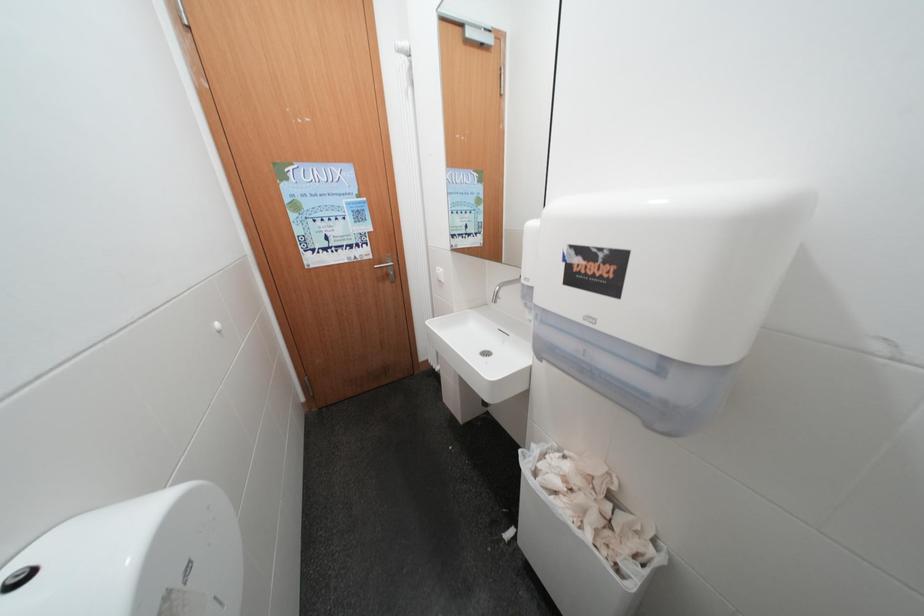
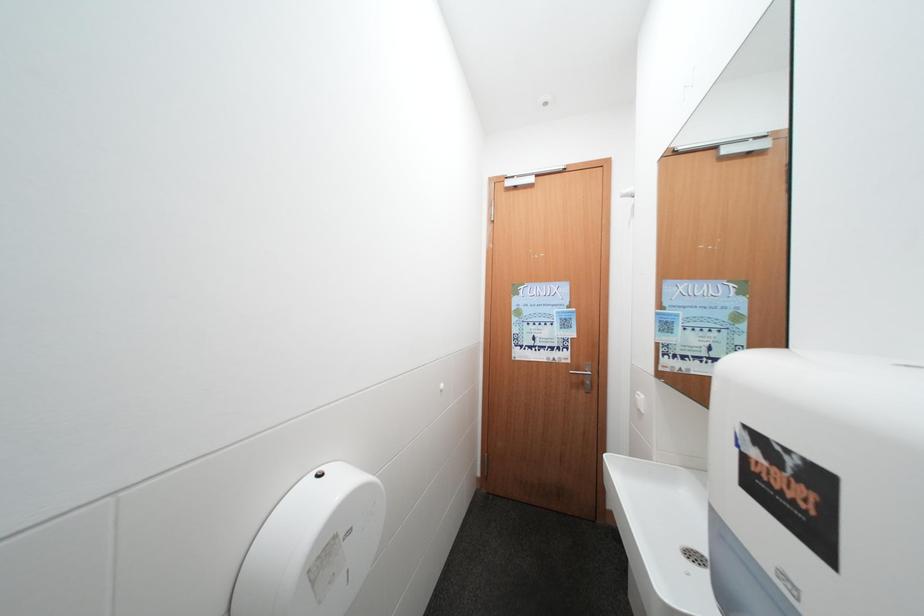
Question: The images are taken continuously from a first-person perspective. In which direction is your viewpoint rotating?

Choices:
 (A) Left
 (B) Right
 (C) Up
 (D) Down

Answer: (A)